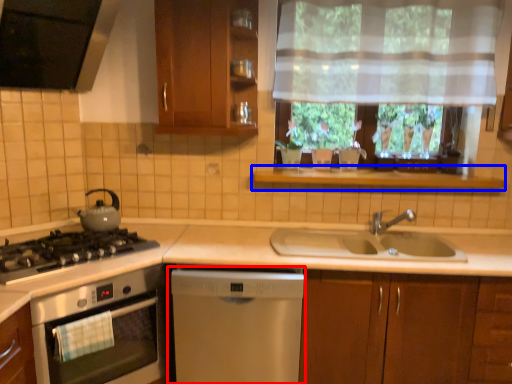
Question: Which point is closer to the camera, dishwasher (highlighted by a red box) or window sill (highlighted by a blue box)?

Choices:
 (A) dishwasher
 (B) window sill

Answer: (A)